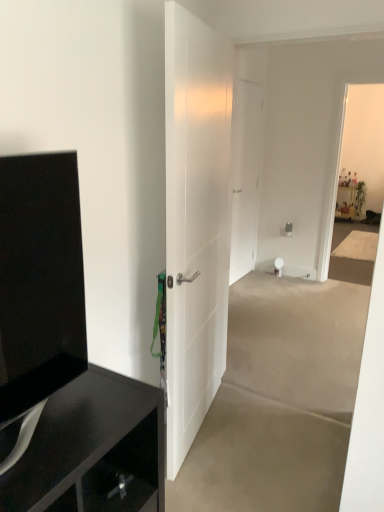
The width and height of the screenshot is (384, 512). I want to click on free location to the right of black glossy tv cabinet at left, so click(x=106, y=416).